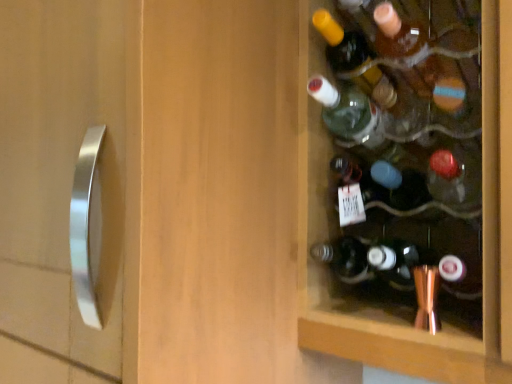
Question: Considering the relative sizes of translucent glass bottle at center, which appears as the fourth bottle when viewed from the top, and translucent glass bottle at upper right, arranged as the 2th bottle when viewed from the top, in the image provided, is translucent glass bottle at center, which appears as the fourth bottle when viewed from the top, smaller than translucent glass bottle at upper right, arranged as the 2th bottle when viewed from the top,?

Choices:
 (A) no
 (B) yes

Answer: (A)

Question: Is translucent glass bottle at center, which appears as the fourth bottle when viewed from the top, outside of translucent glass bottle at upper right, arranged as the 2th bottle when viewed from the top?

Choices:
 (A) no
 (B) yes

Answer: (B)

Question: Is translucent glass bottle at center, which appears as the fourth bottle when viewed from the top, wider than translucent glass bottle at upper right, arranged as the 2th bottle when viewed from the top?

Choices:
 (A) no
 (B) yes

Answer: (A)

Question: Considering the relative positions of translucent glass bottle at center, placed as the 1th bottle when sorted from bottom to top, and translucent glass bottle at upper right, the third bottle ordered from the bottom, in the image provided, is translucent glass bottle at center, placed as the 1th bottle when sorted from bottom to top, to the left of translucent glass bottle at upper right, the third bottle ordered from the bottom, from the viewer's perspective?

Choices:
 (A) yes
 (B) no

Answer: (B)

Question: Is translucent glass bottle at center, which appears as the fourth bottle when viewed from the top, placed right next to translucent glass bottle at upper right, arranged as the 2th bottle when viewed from the top?

Choices:
 (A) no
 (B) yes

Answer: (A)

Question: Is translucent glass bottle at center, placed as the 1th bottle when sorted from bottom to top, further to the viewer compared to translucent glass bottle at upper right, arranged as the 2th bottle when viewed from the top?

Choices:
 (A) yes
 (B) no

Answer: (B)

Question: From a real-world perspective, is translucent glass bottle at upper right, the third bottle ordered from the bottom, positioned over green glass bottle at upper right, the 2th bottle positioned from the bottom, based on gravity?

Choices:
 (A) yes
 (B) no

Answer: (A)

Question: From a real-world perspective, is translucent glass bottle at upper right, the third bottle ordered from the bottom, positioned under green glass bottle at upper right, the 2th bottle positioned from the bottom, based on gravity?

Choices:
 (A) no
 (B) yes

Answer: (A)

Question: Is translucent glass bottle at upper right, arranged as the 2th bottle when viewed from the top, behind green glass bottle at upper right, acting as the third bottle starting from the top?

Choices:
 (A) yes
 (B) no

Answer: (A)

Question: From the image's perspective, would you say translucent glass bottle at upper right, arranged as the 2th bottle when viewed from the top, is shown under green glass bottle at upper right, the 2th bottle positioned from the bottom?

Choices:
 (A) no
 (B) yes

Answer: (A)

Question: From the image's perspective, would you say translucent glass bottle at upper right, arranged as the 2th bottle when viewed from the top, is positioned over green glass bottle at upper right, the 2th bottle positioned from the bottom?

Choices:
 (A) no
 (B) yes

Answer: (B)

Question: Can you confirm if translucent glass bottle at upper right, arranged as the 2th bottle when viewed from the top, is positioned to the left of green glass bottle at upper right, the 2th bottle positioned from the bottom?

Choices:
 (A) no
 (B) yes

Answer: (A)

Question: Are translucent amber glass bottle at upper right, the fourth bottle from the bottom, and translucent glass bottle at center, which appears as the fourth bottle when viewed from the top, located far from each other?

Choices:
 (A) no
 (B) yes

Answer: (A)